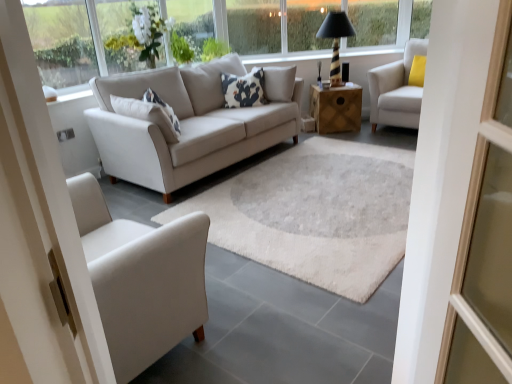
This screenshot has height=384, width=512. What do you see at coordinates (396, 90) in the screenshot?
I see `white fabric armchair at upper right` at bounding box center [396, 90].

The height and width of the screenshot is (384, 512). What do you see at coordinates (130, 34) in the screenshot?
I see `transparent glass window at upper center, the fifth window from the right` at bounding box center [130, 34].

Describe the element at coordinates (244, 89) in the screenshot. I see `white cotton pillow at center` at that location.

The width and height of the screenshot is (512, 384). I want to click on transparent glass window at upper center, marked as the second window in a right-to-left arrangement, so click(x=308, y=23).

Measure the distance between point (331, 69) and camera.

Point (331, 69) is 16.47 feet from camera.

The height and width of the screenshot is (384, 512). I want to click on white fabric armchair at upper right, so click(x=396, y=90).

Image resolution: width=512 pixels, height=384 pixels. What are the coordinates of `pillow that is below the transparent glass window at upper center, the 6th window from the left (from the image's perspective)` in the screenshot? It's located at (244, 89).

Does transparent glass window at upper center, arranged as the first window when viewed from the right, have a greater width compared to white cotton pillow at center?

No, transparent glass window at upper center, arranged as the first window when viewed from the right, is not wider than white cotton pillow at center.

Does transparent glass window at upper center, the 6th window from the left, have a lesser height compared to white cotton pillow at center?

Incorrect, the height of transparent glass window at upper center, the 6th window from the left, does not fall short of that of white cotton pillow at center.

From the image's perspective, is transparent glass window at upper center, arranged as the first window when viewed from the right, on white cotton pillow at center?

Yes, from the image's perspective, transparent glass window at upper center, arranged as the first window when viewed from the right, is over white cotton pillow at center.

Is transparent glass window at upper left, positioned as the 1th window in left-to-right order, thinner than transparent glass window at upper center, which is the 3th window in right-to-left order?

Correct, the width of transparent glass window at upper left, positioned as the 1th window in left-to-right order, is less than that of transparent glass window at upper center, which is the 3th window in right-to-left order.

The height and width of the screenshot is (384, 512). I want to click on window that is the 2nd one above the transparent glass window at upper center, which is the 3th window in right-to-left order (from a real-world perspective), so click(61, 41).

Is transparent glass window at upper left, marked as the sixth window in a right-to-left arrangement, next to transparent glass window at upper center, the 4th window when ordered from left to right, and touching it?

transparent glass window at upper left, marked as the sixth window in a right-to-left arrangement, is not next to transparent glass window at upper center, the 4th window when ordered from left to right, and they're not touching.

From the image's perspective, would you say transparent glass window at upper left, positioned as the 1th window in left-to-right order, is shown under transparent glass window at upper center, which is the 3th window in right-to-left order?

Yes, from the image's perspective, transparent glass window at upper left, positioned as the 1th window in left-to-right order, is below transparent glass window at upper center, which is the 3th window in right-to-left order.

Is clear glass window at upper center, which is counted as the fourth window, starting from the right, taller than white fabric armchair at upper right?

In fact, clear glass window at upper center, which is counted as the fourth window, starting from the right, may be shorter than white fabric armchair at upper right.

Can you confirm if clear glass window at upper center, which is the 3th window in left-to-right order, is smaller than white fabric armchair at upper right?

Yes.

Are clear glass window at upper center, which is counted as the fourth window, starting from the right, and white fabric armchair at upper right located far from each other?

Yes, clear glass window at upper center, which is counted as the fourth window, starting from the right, and white fabric armchair at upper right are located far from each other.

From the image's perspective, which one is positioned higher, clear glass window at upper center, which is the 3th window in left-to-right order, or white fabric armchair at upper right?

clear glass window at upper center, which is the 3th window in left-to-right order, appears higher in the image.

Considering the positions of point (340, 4) and point (387, 27), is point (340, 4) closer or farther from the camera than point (387, 27)?

Point (340, 4) is positioned closer to the camera compared to point (387, 27).

Can you confirm if transparent glass window at upper center, the 5th window from the left, is bigger than transparent glass window at upper center, arranged as the first window when viewed from the right?

Indeed, transparent glass window at upper center, the 5th window from the left, has a larger size compared to transparent glass window at upper center, arranged as the first window when viewed from the right.

Does transparent glass window at upper center, marked as the second window in a right-to-left arrangement, appear on the left side of transparent glass window at upper center, the 6th window from the left?

Yes.

Which is farther from the camera, (115, 46) or (300, 38)?

The point (300, 38) is behind.

How different are the orientations of transparent glass window at upper center, which ranks as the second window in left-to-right order, and transparent glass window at upper center, marked as the second window in a right-to-left arrangement, in degrees?

The facing directions of transparent glass window at upper center, which ranks as the second window in left-to-right order, and transparent glass window at upper center, marked as the second window in a right-to-left arrangement, are 45.3 degrees apart.

Which of these two, transparent glass window at upper center, the fifth window from the right, or transparent glass window at upper center, the 5th window from the left, is thinner?

With smaller width is transparent glass window at upper center, the 5th window from the left.

From a real-world perspective, is wooden side table at center above or below transparent glass window at upper center, the fifth window from the right?

In terms of real-world spatial position, wooden side table at center is below transparent glass window at upper center, the fifth window from the right.

Is wooden side table at center in front of transparent glass window at upper center, the fifth window from the right?

No.

From the image's perspective, relative to transparent glass window at upper center, the 5th window from the left, is wooden side table at center above or below?

wooden side table at center is situated lower than transparent glass window at upper center, the 5th window from the left, in the image.

Is wooden side table at center not close to transparent glass window at upper center, the 5th window from the left?

Yes.

Can you confirm if wooden side table at center is thinner than transparent glass window at upper center, marked as the second window in a right-to-left arrangement?

No.

Which is in front, wooden side table at center or transparent glass window at upper center, marked as the second window in a right-to-left arrangement?

wooden side table at center is in front.

The image size is (512, 384). Find the location of `pillow below the transparent glass window at upper center, the 6th window from the left (from a real-world perspective)`. pillow below the transparent glass window at upper center, the 6th window from the left (from a real-world perspective) is located at coordinates (244, 89).

Locate an element on the screen. Image resolution: width=512 pixels, height=384 pixels. the 3rd window to the left of the transparent glass window at upper center, the 4th window when ordered from left to right, counting from the anchor's position is located at coordinates (x=61, y=41).

Based on their spatial positions, is transparent glass window at upper center, the 6th window from the left, or transparent glass window at upper center, which ranks as the second window in left-to-right order, further from wooden side table at center?

Among the two, transparent glass window at upper center, which ranks as the second window in left-to-right order, is located further to wooden side table at center.

Looking at the image, which one is located further to transparent glass window at upper center, marked as the second window in a right-to-left arrangement, transparent glass window at upper center, which ranks as the second window in left-to-right order, or transparent glass window at upper center, the 4th window when ordered from left to right?

Among the two, transparent glass window at upper center, which ranks as the second window in left-to-right order, is located further to transparent glass window at upper center, marked as the second window in a right-to-left arrangement.

When comparing their distances from transparent glass window at upper center, arranged as the first window when viewed from the right, does white fabric armchair at upper right or transparent glass window at upper center, the fifth window from the right, seem closer?

white fabric armchair at upper right is closer to transparent glass window at upper center, arranged as the first window when viewed from the right.

Which object lies nearer to the anchor point clear glass window at upper center, which is the 3th window in left-to-right order, transparent glass window at upper center, which ranks as the second window in left-to-right order, or black striped lamp at upper right?

Among the two, transparent glass window at upper center, which ranks as the second window in left-to-right order, is located nearer to clear glass window at upper center, which is the 3th window in left-to-right order.

Based on their spatial positions, is clear glass window at upper center, which is the 3th window in left-to-right order, or transparent glass window at upper center, the 4th window when ordered from left to right, further from transparent glass window at upper center, marked as the second window in a right-to-left arrangement?

clear glass window at upper center, which is the 3th window in left-to-right order.

Estimate the real-world distances between objects in this image. Which object is further from transparent glass window at upper center, which is the 3th window in right-to-left order, clear glass window at upper center, which is counted as the fourth window, starting from the right, or wooden side table at center?

Among the two, wooden side table at center is located further to transparent glass window at upper center, which is the 3th window in right-to-left order.

When comparing their distances from clear glass window at upper center, which is counted as the fourth window, starting from the right, does transparent glass window at upper left, positioned as the 1th window in left-to-right order, or transparent glass window at upper center, marked as the second window in a right-to-left arrangement, seem further?

transparent glass window at upper center, marked as the second window in a right-to-left arrangement, lies further to clear glass window at upper center, which is counted as the fourth window, starting from the right, than the other object.

Considering their positions, is transparent glass window at upper center, the 6th window from the left, positioned closer to transparent glass window at upper center, the 4th window when ordered from left to right, than transparent glass window at upper left, marked as the sixth window in a right-to-left arrangement?

transparent glass window at upper center, the 6th window from the left, is closer to transparent glass window at upper center, the 4th window when ordered from left to right.

This screenshot has height=384, width=512. In order to click on table lamp between transparent glass window at upper center, marked as the second window in a right-to-left arrangement, and transparent glass window at upper center, the 6th window from the left in this screenshot , I will do `click(335, 40)`.

Where is `table lamp located between transparent glass window at upper center, which is the 3th window in right-to-left order, and wooden side table at center in the left-right direction`? This screenshot has width=512, height=384. table lamp located between transparent glass window at upper center, which is the 3th window in right-to-left order, and wooden side table at center in the left-right direction is located at coordinates tap(335, 40).

Find the location of a particular element. pillow located between transparent glass window at upper center, which ranks as the second window in left-to-right order, and wooden side table at center in the left-right direction is located at coordinates pyautogui.click(x=244, y=89).

What are the coordinates of `chair that lies between transparent glass window at upper center, arranged as the first window when viewed from the right, and wooden side table at center from top to bottom` in the screenshot? It's located at (396, 90).